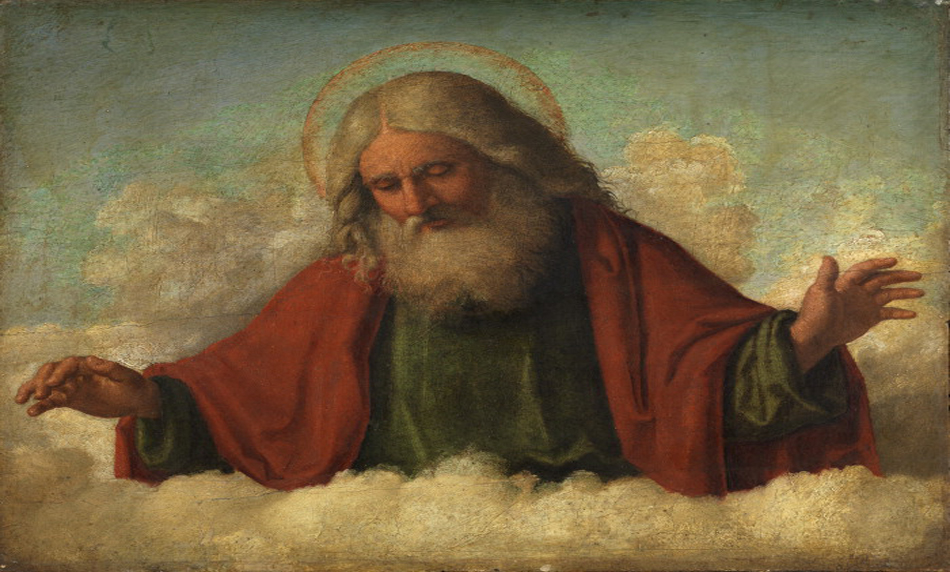
Identify the location of painting. (529, 367).